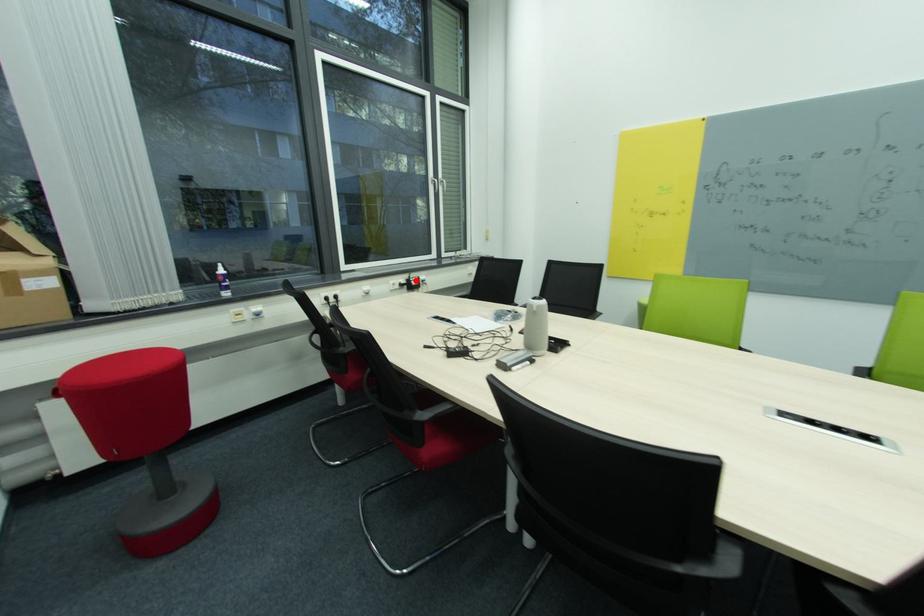
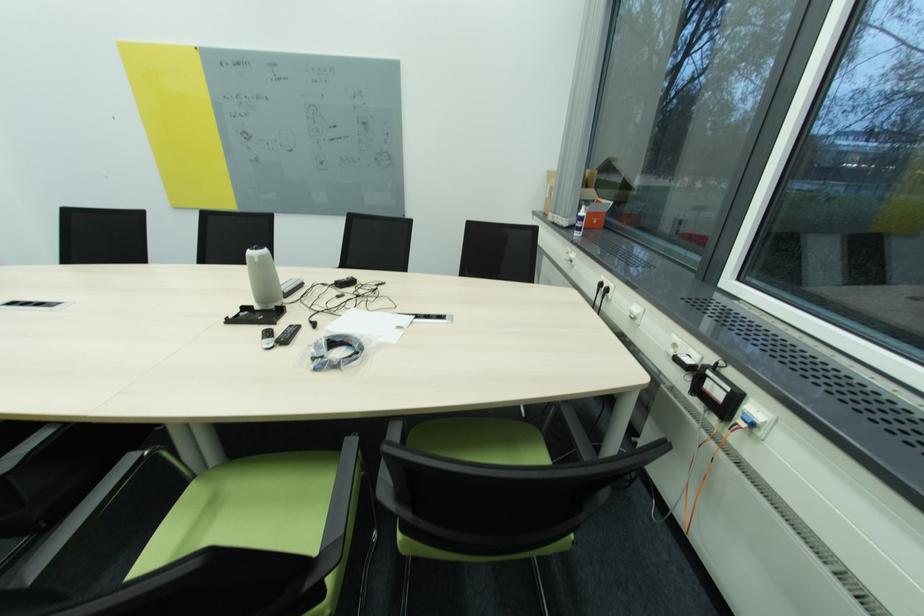
Find the pixel in the second image that matches the highlighted location in the first image.

(713, 373)